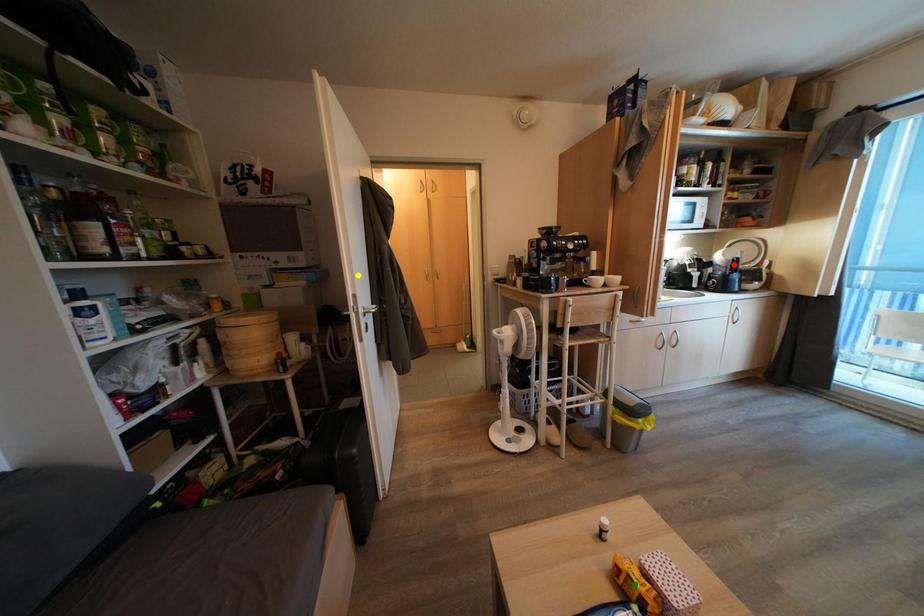
Order these from nearest to farthest:
green point | red point | yellow point

green point < yellow point < red point